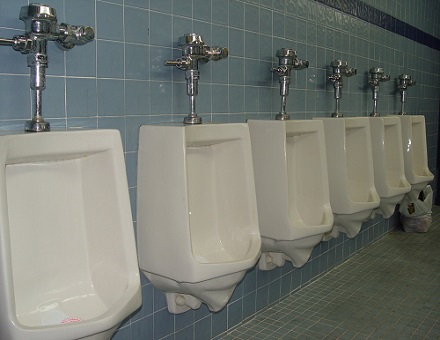
I want to click on urinals, so click(x=70, y=219), click(x=197, y=193), click(x=303, y=170), click(x=348, y=157), click(x=386, y=150), click(x=415, y=149).